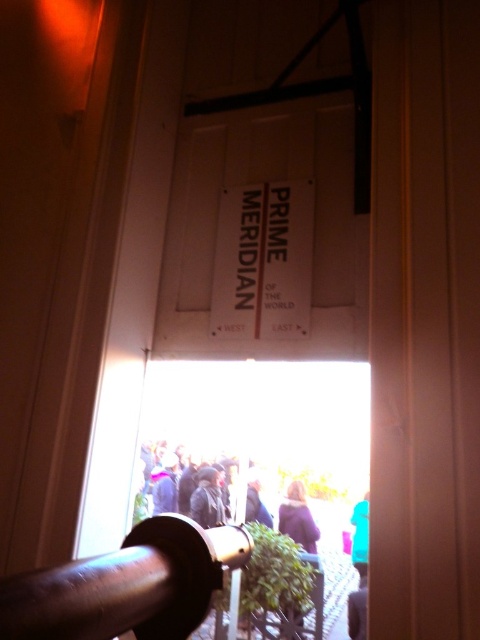
Question: Which object is farther from the camera taking this photo?

Choices:
 (A) dark brown hair at center
 (B) blue fabric person at lower right
 (C) dark gray fabric at lower right
 (D) polished brass rail at center

Answer: (A)

Question: Is dark brown hair at center below blue fabric person at lower right?

Choices:
 (A) yes
 (B) no

Answer: (B)

Question: Is polished brass rail at center above blue fabric person at lower right?

Choices:
 (A) yes
 (B) no

Answer: (A)

Question: Does dark brown hair at center appear under dark gray fabric at lower right?

Choices:
 (A) no
 (B) yes

Answer: (A)

Question: Among these points, which one is nearest to the camera?

Choices:
 (A) (284, 502)
 (B) (100, 580)
 (C) (362, 564)
 (D) (348, 624)

Answer: (B)

Question: Considering the real-world distances, which object is closest to the polished brass rail at center?

Choices:
 (A) blue fabric person at lower right
 (B) dark brown hair at center
 (C) dark gray fabric at lower right

Answer: (C)